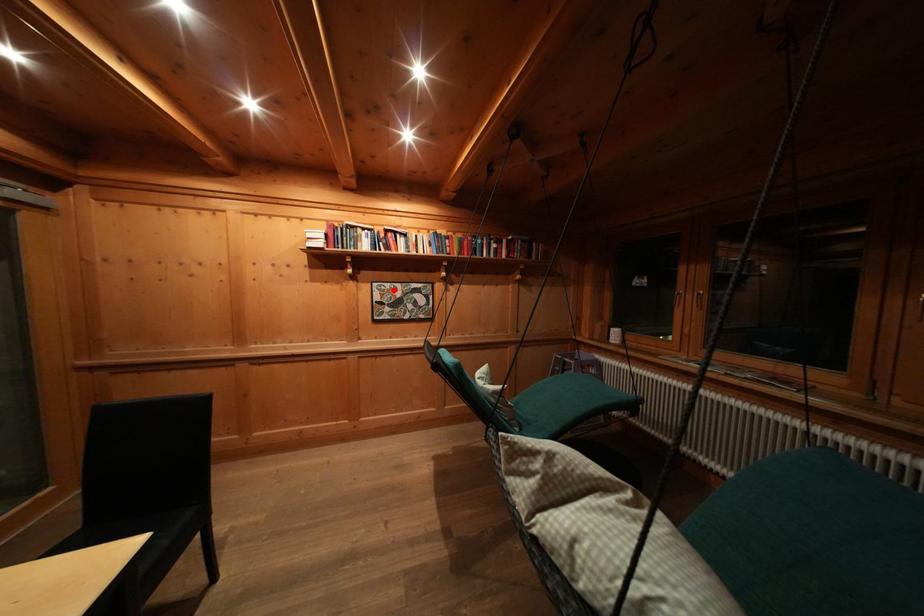
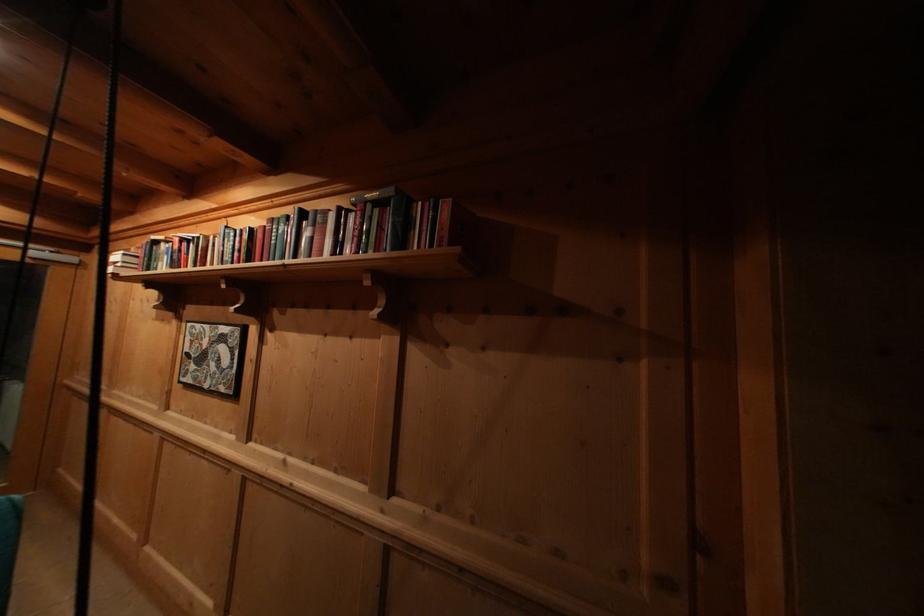
Find the pixel in the second image that matches the highlighted location in the first image.

(204, 331)